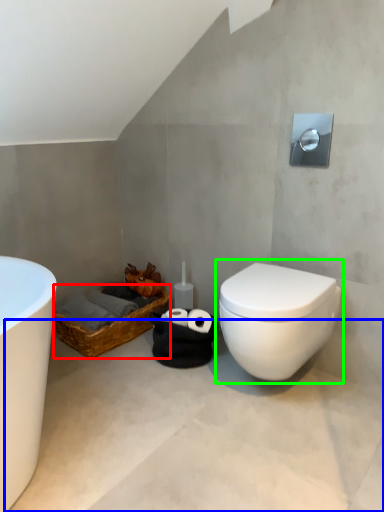
Question: Considering the real-world distances, which object is closest to basket (highlighted by a red box)? concrete (highlighted by a blue box) or toilet (highlighted by a green box).

Choices:
 (A) concrete
 (B) toilet

Answer: (A)